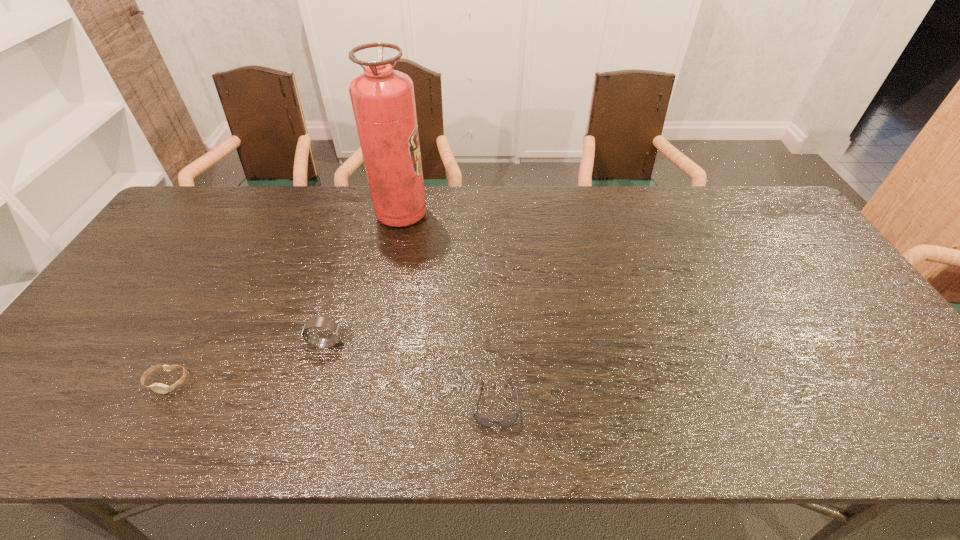
Image resolution: width=960 pixels, height=540 pixels. Identify the location of object located at the far edge. (383, 102).

Locate an element on the screen. This screenshot has width=960, height=540. object that is at the near edge is located at coordinates (481, 420).

You are a GUI agent. You are given a task and a screenshot of the screen. Output one action in this format:
    pyautogui.click(x=<x>, y=<y>)
    Task: Click on the vacant space at the far edge of the desktop
    Image resolution: width=960 pixels, height=540 pixels.
    Given the screenshot: What is the action you would take?
    pyautogui.click(x=337, y=202)

The width and height of the screenshot is (960, 540). I want to click on vacant space at the near edge of the desktop, so click(x=211, y=430).

You are a GUI agent. You are given a task and a screenshot of the screen. Output one action in this format:
    pyautogui.click(x=<x>, y=<y>)
    Task: Click on the vacant space at the left edge of the desktop
    
    Given the screenshot: What is the action you would take?
    pyautogui.click(x=139, y=335)

What are the coordinates of `free spot at the far left corner of the desktop` in the screenshot? It's located at (183, 215).

In order to click on empty space between the fire extinguisher and the third nearest object in this screenshot , I will do `click(364, 279)`.

Where is `blank region between the rightmost object and the tallest object`? This screenshot has height=540, width=960. blank region between the rightmost object and the tallest object is located at coordinates (448, 309).

This screenshot has height=540, width=960. I want to click on vacant area that lies between the sunglasses and the second farthest object, so click(x=411, y=374).

Find the location of a particular element. unoccupied position between the fire extinguisher and the farther watch is located at coordinates (364, 279).